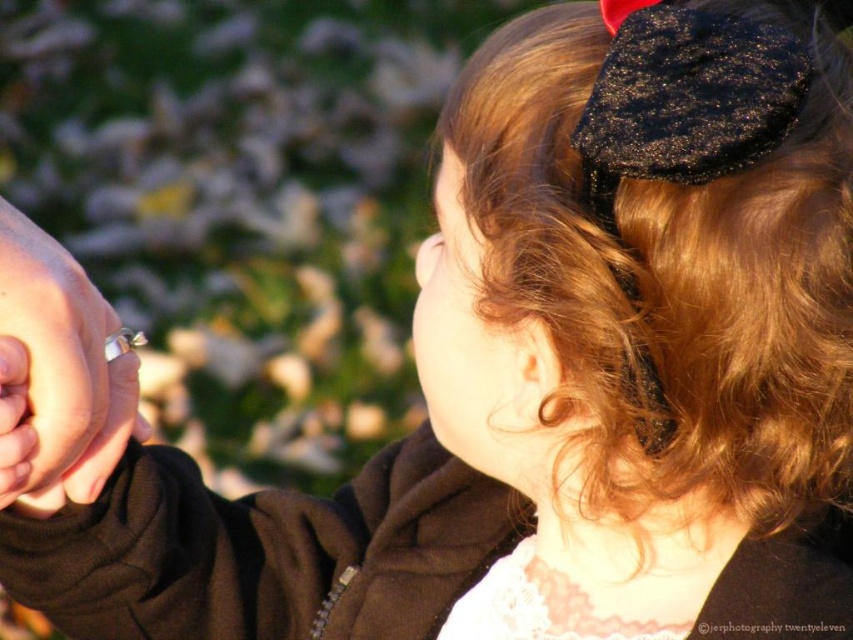
Looking at this image, you are a photographer trying to focus on the shiny brown hair at upper right and the silver metallic ring at left in the image. Which object should you adjust your camera to focus on first if you want to ensure both are in focus, considering their positions relative to the camera?

The silver metallic ring at left should be focused on first because it is closer to the camera than the shiny brown hair at upper right, which is above it. Adjusting focus starting from the closer object increases the chances of both being in focus.

You are a photographer adjusting the focus on your camera. You need to ensure that both the shiny brown hair at upper right and the silver metallic ring at left are in focus. Given their positions, which object should you focus on first to maintain clarity for both?

The shiny brown hair at upper right is much taller than the silver metallic ring at left. To keep both in focus, you should focus on the shiny brown hair at upper right first because it is farther away, allowing the depth of field to cover the closer silver metallic ring at left.